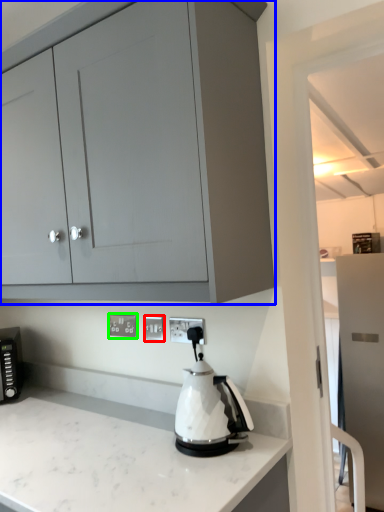
Question: Which object is the farthest from electric outlet (highlighted by a red box)? Choose among these: cabinetry (highlighted by a blue box) or electric outlet (highlighted by a green box).

Choices:
 (A) cabinetry
 (B) electric outlet

Answer: (A)